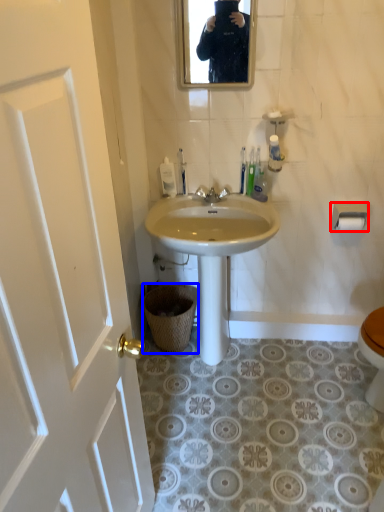
Question: Which object appears closest to the camera in this image, toilet paper (highlighted by a red box) or trash bin/can (highlighted by a blue box)?

Choices:
 (A) toilet paper
 (B) trash bin/can

Answer: (A)